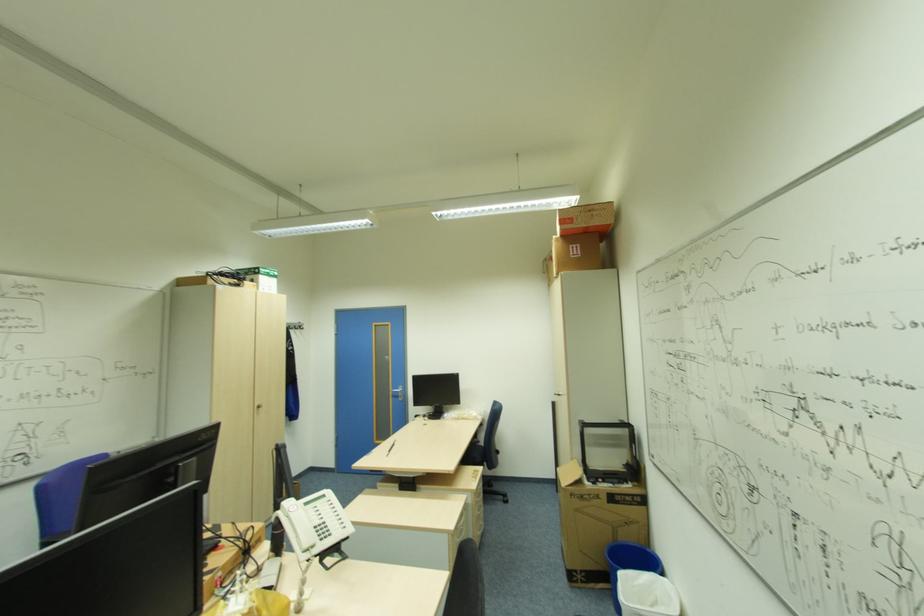
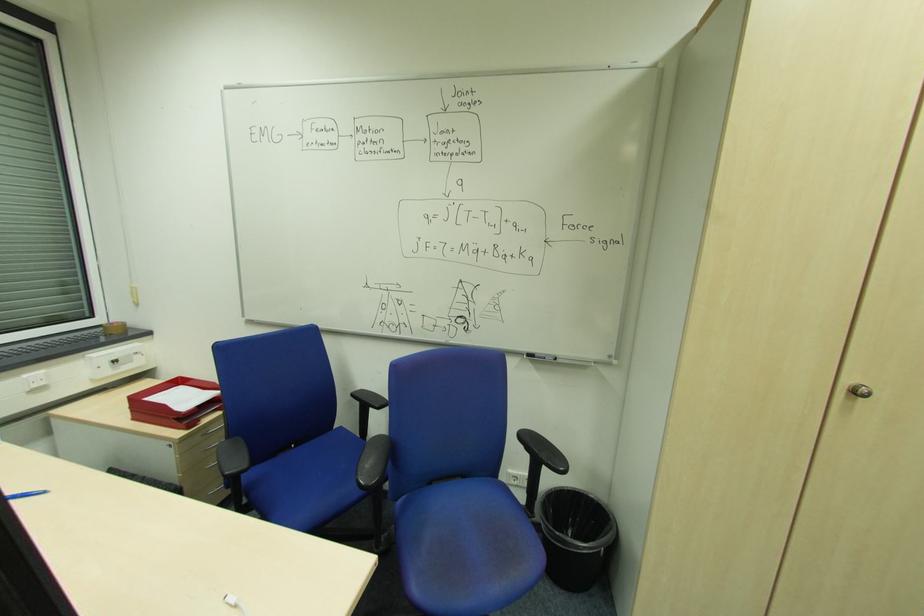
Locate, in the second image, the point that corresponds to point 261,407 in the first image.

(860, 392)